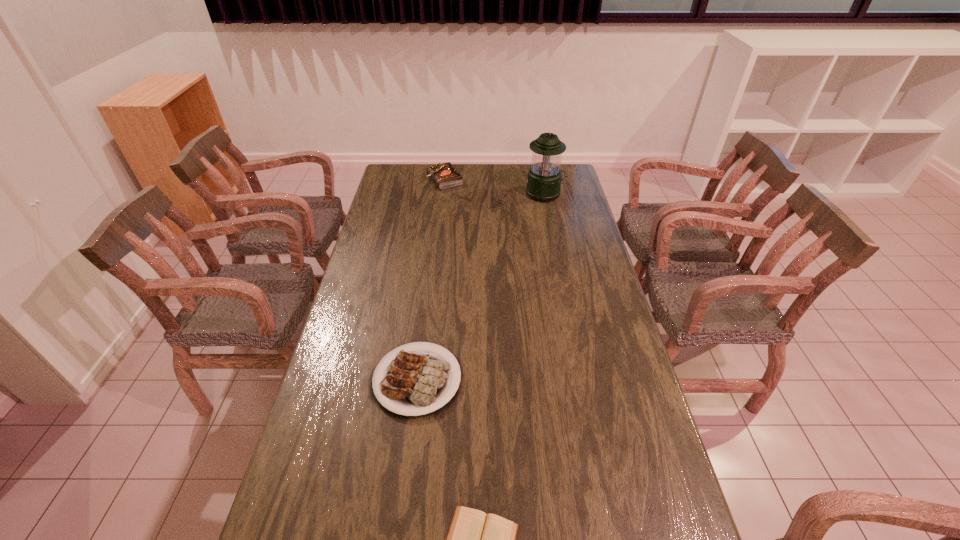
I want to click on lantern, so click(x=544, y=177).

The height and width of the screenshot is (540, 960). What are the coordinates of `the tallest object` in the screenshot? It's located at (544, 177).

Find the location of `the taller diary`. the taller diary is located at coordinates (445, 175).

The image size is (960, 540). Identify the location of the farther diary. (445, 175).

Locate an element on the screen. the third farthest object is located at coordinates pyautogui.click(x=416, y=382).

I want to click on the third tallest object, so click(x=416, y=382).

The image size is (960, 540). Find the location of `vacant area situated on the back of the lantern`. vacant area situated on the back of the lantern is located at coordinates [540, 167].

Locate an element on the screen. This screenshot has height=540, width=960. vacant area located 0.330m on the front of the farther diary is located at coordinates (439, 233).

Identify the location of vacant space located on the front of the second nearest object. The width and height of the screenshot is (960, 540). pos(399,521).

Locate an element on the screen. The image size is (960, 540). lantern that is positioned at the far edge is located at coordinates (544, 177).